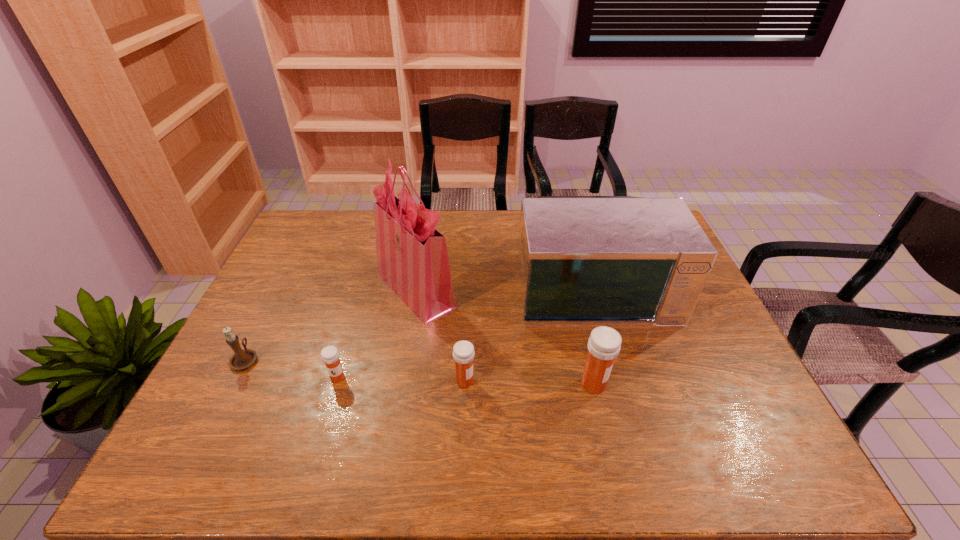
Identify the location of object present at the right edge. (582, 260).

At what (x,y) coordinates should I click in order to perform the action: click on vacant region at the far edge of the desktop. Please return your answer as a coordinate pair (x, y). The image size is (960, 540). Looking at the image, I should click on (361, 248).

Find the location of a particular element. vacant area at the near edge of the desktop is located at coordinates (532, 424).

You are a GUI agent. You are given a task and a screenshot of the screen. Output one action in this format:
    pyautogui.click(x=<x>, y=<y>)
    Task: Click on the vacant space at the left edge of the desktop
    The image size is (960, 540).
    Given the screenshot: What is the action you would take?
    pyautogui.click(x=271, y=295)

This screenshot has width=960, height=540. Identify the location of vacant space at the right edge of the desktop. (678, 368).

The width and height of the screenshot is (960, 540). Find the location of `vacant space at the far left corner`. vacant space at the far left corner is located at coordinates (312, 213).

Where is `vacant point located between the second tallest medicine and the fifth object from right to left`? vacant point located between the second tallest medicine and the fifth object from right to left is located at coordinates pos(401,379).

You are a GUI agent. You are given a task and a screenshot of the screen. Output one action in this format:
    pyautogui.click(x=<x>, y=<y>)
    Task: Click on the vacant space in between the shopping bag and the second medicine from right to left
    The image size is (960, 540).
    Given the screenshot: What is the action you would take?
    pyautogui.click(x=441, y=335)

Where is `free space between the leftmost object and the second object from left to right`? free space between the leftmost object and the second object from left to right is located at coordinates (291, 368).

At what (x,y) coordinates should I click in order to perform the action: click on empty space that is in between the shortest medicine and the second medicine from right to left. Please return your answer as a coordinate pair (x, y). The height and width of the screenshot is (540, 960). Looking at the image, I should click on (401, 379).